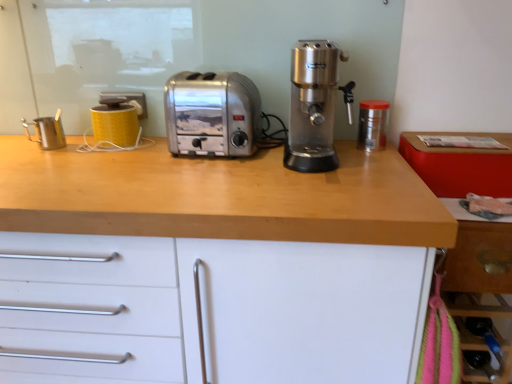
Question: Does yellow matte mug at upper left, which is the 2th kitchen appliance in left-to-right order, turn towards satin silver toaster at center?

Choices:
 (A) yes
 (B) no

Answer: (B)

Question: Considering the relative sizes of yellow matte mug at upper left, which is the 2th kitchen appliance in left-to-right order, and satin silver toaster at center in the image provided, is yellow matte mug at upper left, which is the 2th kitchen appliance in left-to-right order, wider than satin silver toaster at center?

Choices:
 (A) yes
 (B) no

Answer: (B)

Question: Considering the relative positions of yellow matte mug at upper left, which ranks as the second kitchen appliance in right-to-left order, and satin silver toaster at center in the image provided, is yellow matte mug at upper left, which ranks as the second kitchen appliance in right-to-left order, behind satin silver toaster at center?

Choices:
 (A) yes
 (B) no

Answer: (A)

Question: Is yellow matte mug at upper left, which is the 2th kitchen appliance in left-to-right order, positioned before satin silver toaster at center?

Choices:
 (A) yes
 (B) no

Answer: (B)

Question: Considering the relative sizes of yellow matte mug at upper left, which is the 2th kitchen appliance in left-to-right order, and satin silver toaster at center in the image provided, is yellow matte mug at upper left, which is the 2th kitchen appliance in left-to-right order, smaller than satin silver toaster at center?

Choices:
 (A) yes
 (B) no

Answer: (A)

Question: In terms of width, does yellow matte mug at upper left, which is the 2th kitchen appliance in left-to-right order, look wider or thinner when compared to transparent plastic container at right, the 1th kitchen appliance in the right-to-left sequence?

Choices:
 (A) thin
 (B) wide

Answer: (B)

Question: Considering the relative positions of yellow matte mug at upper left, which ranks as the second kitchen appliance in right-to-left order, and transparent plastic container at right, the 1th kitchen appliance in the right-to-left sequence, in the image provided, is yellow matte mug at upper left, which ranks as the second kitchen appliance in right-to-left order, to the left or to the right of transparent plastic container at right, the 1th kitchen appliance in the right-to-left sequence,?

Choices:
 (A) right
 (B) left

Answer: (B)

Question: Does point (118, 114) appear closer or farther from the camera than point (376, 137)?

Choices:
 (A) closer
 (B) farther

Answer: (B)

Question: From their relative heights in the image, would you say yellow matte mug at upper left, which is the 2th kitchen appliance in left-to-right order, is taller or shorter than transparent plastic container at right, the 1th kitchen appliance in the right-to-left sequence?

Choices:
 (A) tall
 (B) short

Answer: (A)

Question: From a real-world perspective, relative to transparent plastic container at right, arranged as the 3th kitchen appliance when viewed from the left, is wooden drawer at lower right vertically above or below?

Choices:
 (A) above
 (B) below

Answer: (B)

Question: From the image's perspective, relative to transparent plastic container at right, arranged as the 3th kitchen appliance when viewed from the left, is wooden drawer at lower right above or below?

Choices:
 (A) above
 (B) below

Answer: (B)

Question: Do you think wooden drawer at lower right is within transparent plastic container at right, the 1th kitchen appliance in the right-to-left sequence, or outside of it?

Choices:
 (A) outside
 (B) inside

Answer: (A)

Question: In terms of width, does wooden drawer at lower right look wider or thinner when compared to transparent plastic container at right, arranged as the 3th kitchen appliance when viewed from the left?

Choices:
 (A) wide
 (B) thin

Answer: (A)

Question: Looking at the image, does satin silver coffee machine at center seem bigger or smaller compared to wooden countertop at center?

Choices:
 (A) big
 (B) small

Answer: (B)

Question: Is satin silver coffee machine at center in front of or behind wooden countertop at center in the image?

Choices:
 (A) behind
 (B) front

Answer: (A)